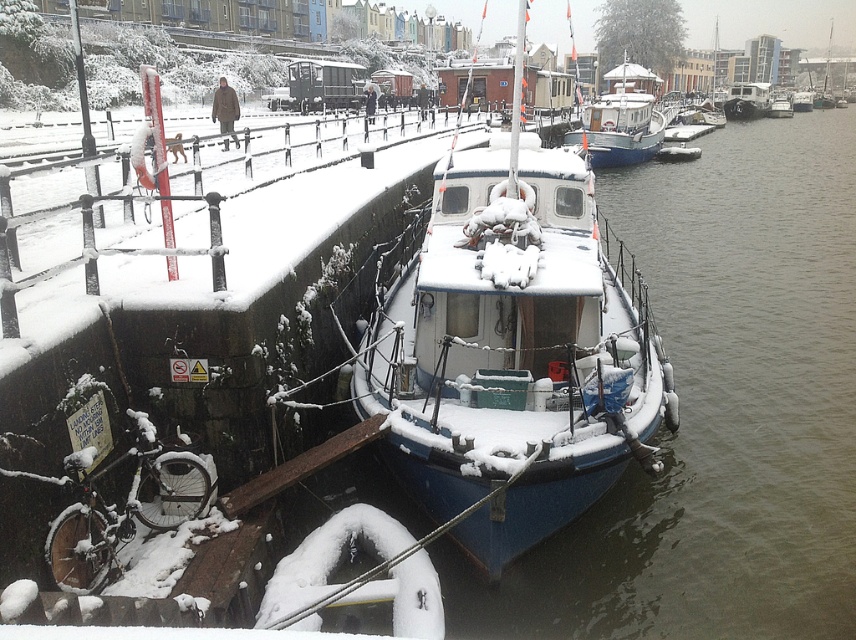
You are standing at the point with coordinates (513, 352) in the winter scene. What object are you standing on?

The point at coordinates (513, 352) corresponds to the blue matte boat at center.

You are a delivery person needing to place a package between the blue matte boat at center and the white glossy boat at center. The package requires a minimum of 10 meters of space between the two boats to be safely placed. Can you safely place the package there?

The blue matte boat at center and white glossy boat at center are 11.65 meters apart from each other, which exceeds the required 10 meters. Therefore, you can safely place the package between them.

You are standing at the edge of the dock looking at the boat. There are two points marked on the boat deck. Which point is closer to you, point at coordinate (528, 276) or point at coordinate (599, 125)?

Point at coordinate (528, 276) is closer to you than point at coordinate (599, 125).